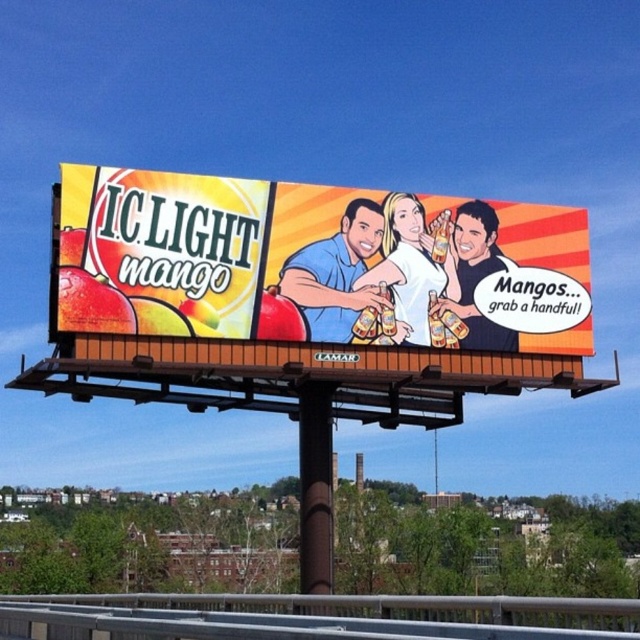
Can you confirm if smooth skin man at center is positioned below smooth skin tone at center?

Yes, smooth skin man at center is below smooth skin tone at center.

Can you confirm if smooth skin man at center is positioned to the right of smooth skin tone at center?

No, smooth skin man at center is not to the right of smooth skin tone at center.

Is point (364, 307) farther from viewer compared to point (408, 339)?

No, it is in front of (408, 339).

Find the location of a particular element. The height and width of the screenshot is (640, 640). smooth skin man at center is located at coordinates tap(337, 275).

Can you confirm if matte yellow billboard at center is positioned above smooth plastic beer bottle at center?

Yes, matte yellow billboard at center is above smooth plastic beer bottle at center.

The width and height of the screenshot is (640, 640). What do you see at coordinates (316, 262) in the screenshot?
I see `matte yellow billboard at center` at bounding box center [316, 262].

Find the location of `matte yellow billboard at center`. matte yellow billboard at center is located at coordinates (316, 262).

Between matte yellow billboard at center and smooth skin tone at center, which one has more height?

With more height is matte yellow billboard at center.

Can you confirm if matte yellow billboard at center is positioned to the right of smooth skin tone at center?

Incorrect, matte yellow billboard at center is not on the right side of smooth skin tone at center.

Which is in front, point (225, 212) or point (422, 273)?

Point (225, 212) is more forward.

Where is `matte yellow billboard at center`? This screenshot has width=640, height=640. matte yellow billboard at center is located at coordinates (316, 262).